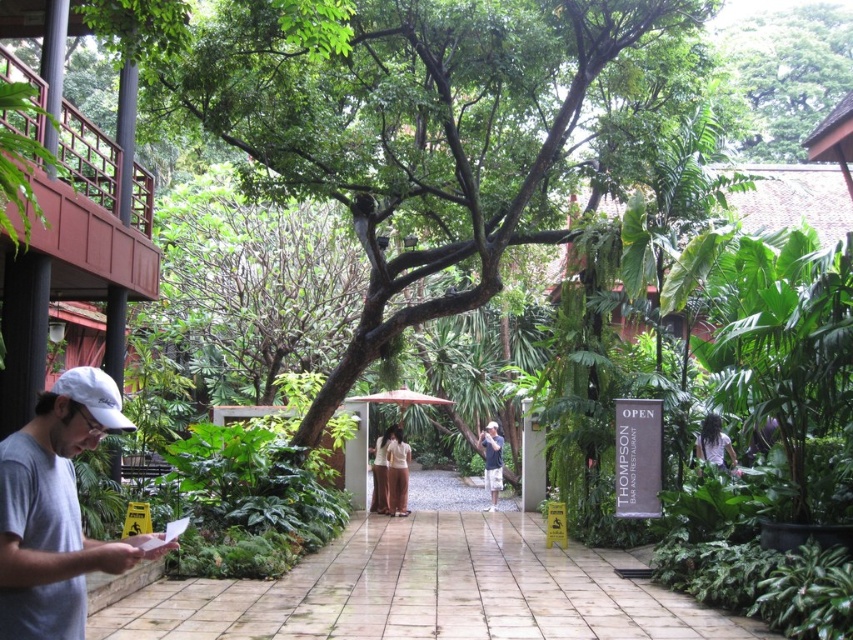
Question: Considering the relative positions of green leafy tree at center and white matte baseball cap at left in the image provided, where is green leafy tree at center located with respect to white matte baseball cap at left?

Choices:
 (A) right
 (B) left

Answer: (A)

Question: Which object appears farthest from the camera in this image?

Choices:
 (A) dark purple shirt at center
 (B) light beige fabric dress at center

Answer: (B)

Question: Does smooth stone path at center appear on the right side of dark purple shirt at center?

Choices:
 (A) no
 (B) yes

Answer: (A)

Question: Which point is closer to the camera taking this photo?

Choices:
 (A) (389, 483)
 (B) (384, 436)
 (C) (67, 452)
 (D) (78, 380)

Answer: (C)

Question: Does white matte baseball cap at left have a larger size compared to light brown fabric pants at center?

Choices:
 (A) no
 (B) yes

Answer: (A)

Question: Which object appears farthest from the camera in this image?

Choices:
 (A) light brown fabric pants at center
 (B) light beige fabric dress at center
 (C) green leafy tree at center
 (D) white matte baseball cap at left

Answer: (B)